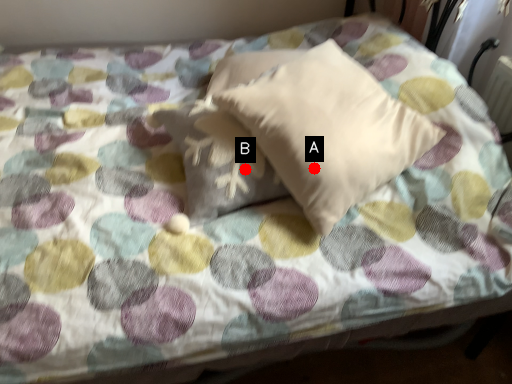
Question: Two points are circled on the image, labeled by A and B beside each circle. Which of the following is the farthest from the observer?

Choices:
 (A) A is further
 (B) B is further

Answer: (B)